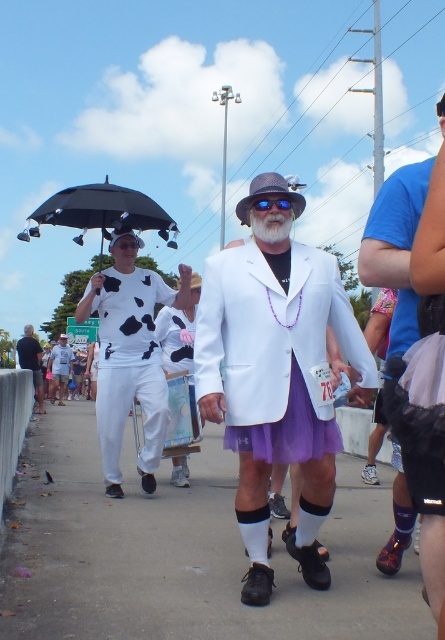
Who is higher up, purple satin skirt at center or white matte/soft suit at lower left?

Positioned higher is purple satin skirt at center.

Looking at this image, who is positioned more to the left, purple satin skirt at center or white matte/soft suit at lower left?

white matte/soft suit at lower left

Does point (432, 465) come farther from viewer compared to point (33, 372)?

No, (432, 465) is closer to viewer.

The height and width of the screenshot is (640, 445). What are the coordinates of `purple satin skirt at center` in the screenshot? It's located at point(396,248).

Which is more to the right, black matte umbrella at upper left or white matte/soft fabric pants at left?

Positioned to the right is white matte/soft fabric pants at left.

Does black matte umbrella at upper left have a larger size compared to white matte/soft fabric pants at left?

Correct, black matte umbrella at upper left is larger in size than white matte/soft fabric pants at left.

Who is more distant from viewer, [76,227] or [64,337]?

Positioned behind is point [64,337].

This screenshot has width=445, height=640. I want to click on black matte umbrella at upper left, so click(101, 212).

Does white matte blazer at center have a lesser width compared to purple satin skirt at center?

Yes, white matte blazer at center is thinner than purple satin skirt at center.

Is white matte blazer at center bigger than purple satin skirt at center?

No.

Who is more forward, (250,488) or (416,508)?

Point (416,508)

At what (x,y) coordinates should I click in order to perform the action: click on white matte blazer at center. Please return your answer as a coordinate pair (x, y). Looking at the image, I should click on (275, 387).